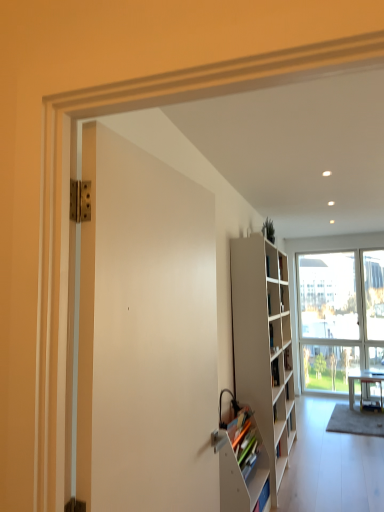
Find the location of a particular element. This screenshot has height=512, width=384. white glass window at center is located at coordinates (339, 316).

Describe the element at coordinates (339, 316) in the screenshot. I see `white glass window at center` at that location.

What is the approximate width of white matte door at center?

white matte door at center is 9.90 centimeters in width.

The height and width of the screenshot is (512, 384). Find the location of `white glass window at center`. white glass window at center is located at coordinates (339, 316).

In the scene shown: Is gray carpet at lower right positioned with its back to white glass window at center?

That's not correct — gray carpet at lower right is not looking away from white glass window at center.

Between gray carpet at lower right and white glass window at center, which one has larger size?

white glass window at center is bigger.

Is gray carpet at lower right situated inside white glass window at center or outside?

gray carpet at lower right exists outside the volume of white glass window at center.

Which object is wider, gray carpet at lower right or white glass window at center?

gray carpet at lower right is wider.

From a real-world perspective, does white glass window at center sit lower than white matte door at center?

Yes.

How many degrees apart are the facing directions of white glass window at center and white matte door at center?

The angular difference between white glass window at center and white matte door at center is 93.4 degrees.

Between white glass window at center and white matte door at center, which one has smaller width?

white matte door at center is thinner.

Would you say white glass window at center is to the left or to the right of white matte door at center in the picture?

white glass window at center is positioned on white matte door at center's right side.

From a real-world perspective, which is physically above, white glossy desk at lower right or green matte plant at upper center?

green matte plant at upper center.

Consider the image. Is white glossy desk at lower right far from green matte plant at upper center?

white glossy desk at lower right is positioned a significant distance from green matte plant at upper center.

Is point (381, 380) closer or farther from the camera than point (263, 223)?

Point (381, 380).

Is point (322, 333) farther from viewer compared to point (341, 415)?

Yes, point (322, 333) is farther from viewer.

Consider the image. Is white glass window at center positioned with its back to gray carpet at lower right?

No, gray carpet at lower right is not at the back of white glass window at center.

Does white glass window at center have a lesser height compared to gray carpet at lower right?

In fact, white glass window at center may be taller than gray carpet at lower right.

Consider the image. Can you confirm if white glass window at center is positioned to the right of gray carpet at lower right?

Indeed, white glass window at center is positioned on the right side of gray carpet at lower right.

Does white matte bookshelf at lower right turn towards white glossy desk at lower right?

No, white matte bookshelf at lower right does not turn towards white glossy desk at lower right.

Can you confirm if white matte bookshelf at lower right is smaller than white glossy desk at lower right?

Incorrect, white matte bookshelf at lower right is not smaller in size than white glossy desk at lower right.

Would you consider white matte bookshelf at lower right to be distant from white glossy desk at lower right?

That's right, there is a large distance between white matte bookshelf at lower right and white glossy desk at lower right.

Is green matte plant at upper center situated inside white glossy desk at lower right or outside?

green matte plant at upper center lies outside white glossy desk at lower right.

Locate an element on the screen. The width and height of the screenshot is (384, 512). desk below the green matte plant at upper center (from a real-world perspective) is located at coordinates (362, 380).

Which point is more distant from viewer, (267, 217) or (353, 385)?

The point (353, 385) is behind.

Does green matte plant at upper center have a larger size compared to white glossy desk at lower right?

No.

Does gray carpet at lower right have a greater width compared to white matte bookshelf at right?

Correct, the width of gray carpet at lower right exceeds that of white matte bookshelf at right.

Between gray carpet at lower right and white matte bookshelf at right, which one has more height?

white matte bookshelf at right.

Where is `carpets that is behind the white matte bookshelf at right`? The width and height of the screenshot is (384, 512). carpets that is behind the white matte bookshelf at right is located at coordinates (356, 421).

How many degrees apart are the facing directions of gray carpet at lower right and white matte bookshelf at right?

The angular difference between gray carpet at lower right and white matte bookshelf at right is 95.6 degrees.

In order to click on window located on the right of gray carpet at lower right in this screenshot , I will do `click(339, 316)`.

The height and width of the screenshot is (512, 384). What are the coordinates of `screen door above the white glass window at center (from a real-world perspective)` in the screenshot? It's located at (152, 335).

Looking at the image, which one is located further to white matte door at center, white glossy desk at lower right or white glass window at center?

white glass window at center is positioned further to the anchor white matte door at center.

Based on their spatial positions, is white matte bookshelf at lower right or white glass window at center closer to white matte door at center?

Among the two, white matte bookshelf at lower right is located nearer to white matte door at center.

When comparing their distances from white glossy desk at lower right, does white matte bookshelf at lower right or gray carpet at lower right seem closer?

gray carpet at lower right is closer to white glossy desk at lower right.

Consider the image. From the image, which object appears to be farther from white matte door at center, white matte bookshelf at right or white glass window at center?

white glass window at center is further to white matte door at center.

Based on their spatial positions, is white matte bookshelf at right or white glossy desk at lower right further from white matte bookshelf at lower right?

white glossy desk at lower right.

When comparing their distances from white glass window at center, does gray carpet at lower right or white glossy desk at lower right seem closer?

white glossy desk at lower right is positioned closer to the anchor white glass window at center.

Which object lies further to the anchor point green matte plant at upper center, white matte bookshelf at lower right or white matte door at center?

Among the two, white matte door at center is located further to green matte plant at upper center.

Considering their positions, is white glass window at center positioned closer to green matte plant at upper center than gray carpet at lower right?

Based on the image, white glass window at center appears to be nearer to green matte plant at upper center.

Identify the location of carpets positioned between white matte door at center and white glass window at center from near to far. The width and height of the screenshot is (384, 512). (356, 421).

You are a GUI agent. You are given a task and a screenshot of the screen. Output one action in this format:
    pyautogui.click(x=<x>, y=<y>)
    Task: Click on the cabinetry between white matte bookshelf at lower right and white glass window at center from front to back
    The width and height of the screenshot is (384, 512).
    Given the screenshot: What is the action you would take?
    pyautogui.click(x=264, y=346)

Locate an element on the screen. This screenshot has width=384, height=512. houseplant located between white matte bookshelf at right and white glossy desk at lower right in the depth direction is located at coordinates (269, 230).

Find the location of `window that lies between green matte plant at upper center and white glossy desk at lower right from top to bottom`. window that lies between green matte plant at upper center and white glossy desk at lower right from top to bottom is located at coordinates (339, 316).